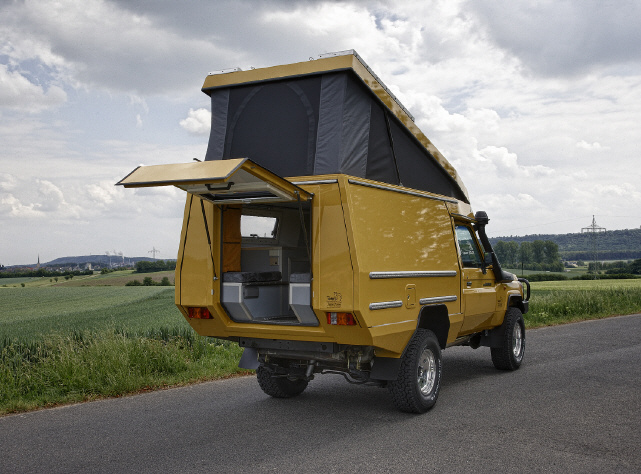
This screenshot has width=641, height=474. What are the coordinates of `seat` in the screenshot? It's located at (256, 275), (300, 277).